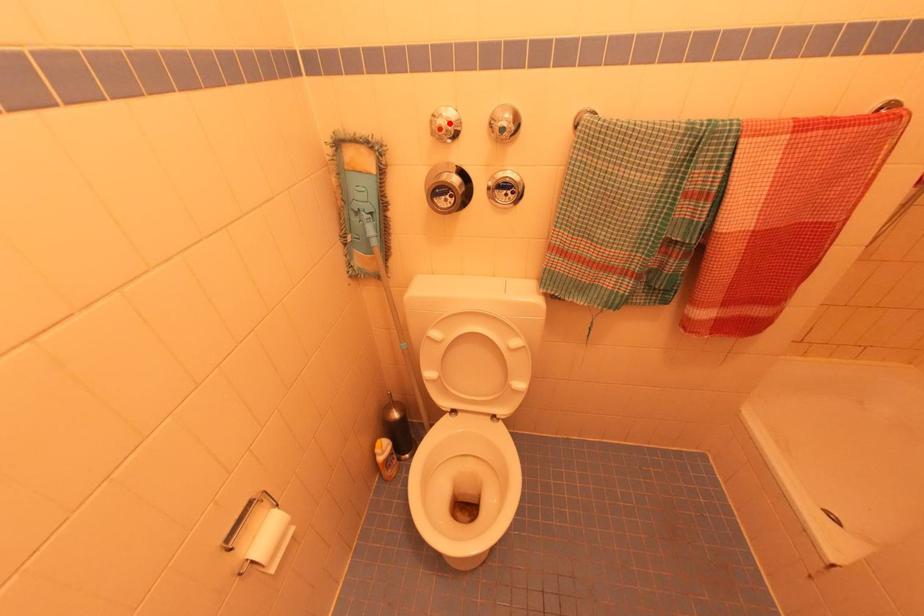
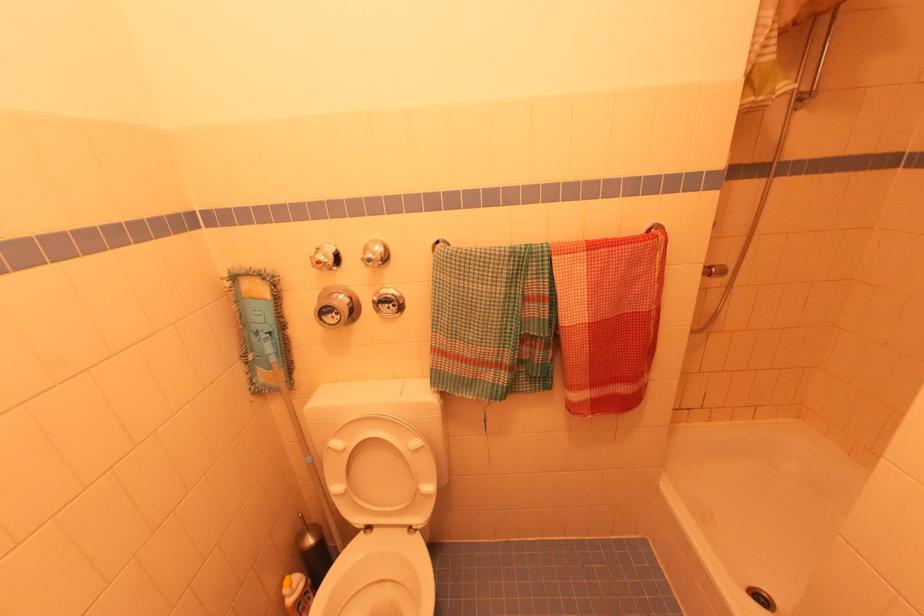
Where in the second image is the point corresponding to the highlighted location from the first image?

(327, 257)